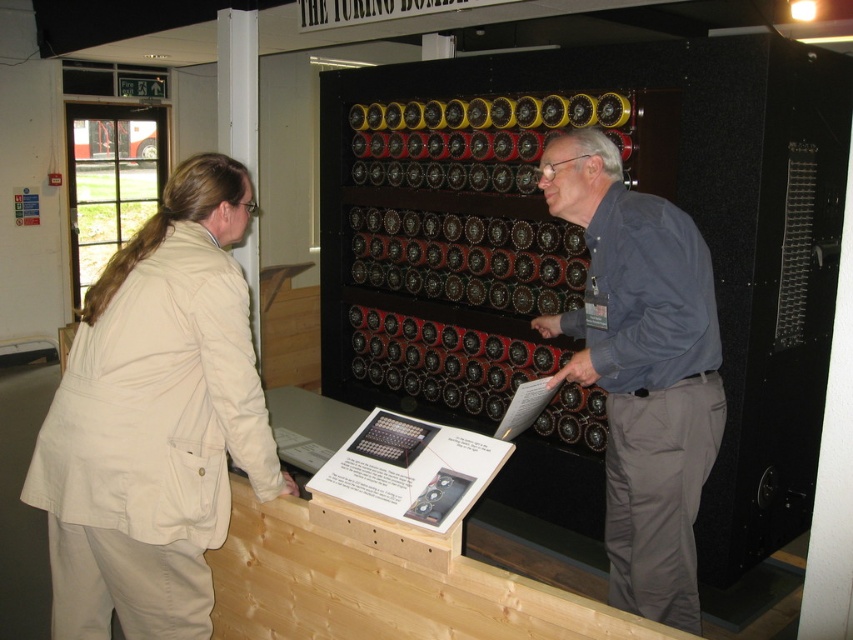
Is beige fabric jacket at left to the right of blue shirt at center from the viewer's perspective?

Incorrect, beige fabric jacket at left is not on the right side of blue shirt at center.

Does beige fabric jacket at left have a greater height compared to blue shirt at center?

Incorrect, beige fabric jacket at left's height is not larger of blue shirt at center's.

Is point (102, 404) farther from camera compared to point (599, 156)?

No, it is not.

Locate an element on the screen. The width and height of the screenshot is (853, 640). beige fabric jacket at left is located at coordinates (155, 419).